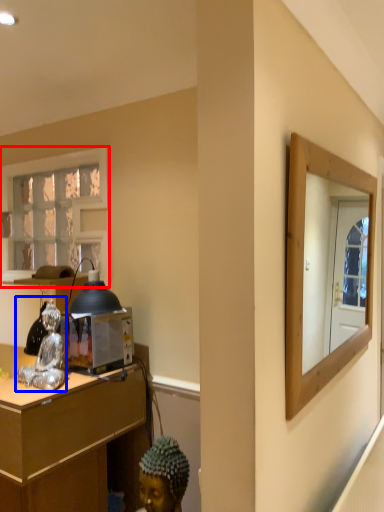
Question: Which object appears farthest to the camera in this image, window (highlighted by a red box) or figurine (highlighted by a blue box)?

Choices:
 (A) window
 (B) figurine

Answer: (A)